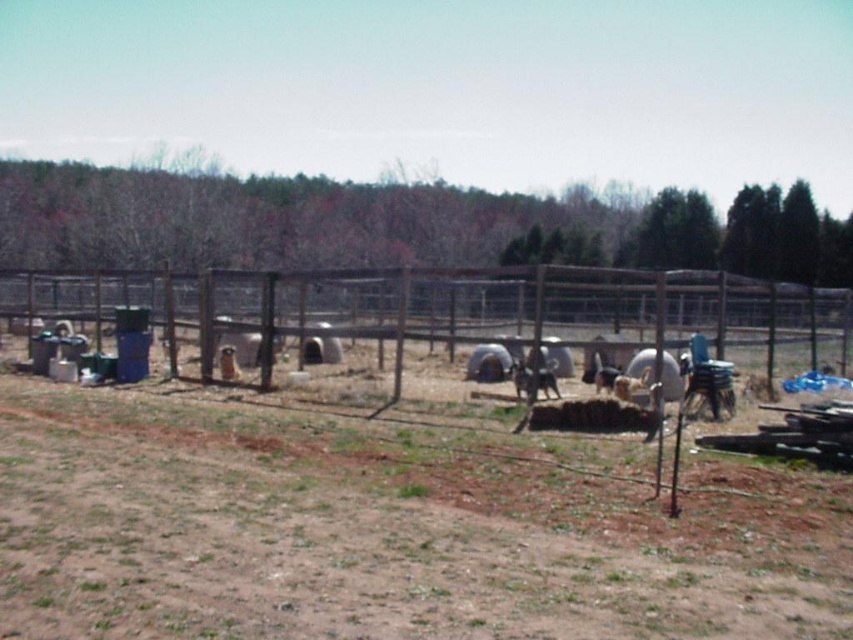
Is brown dirt field at lower center further to camera compared to brown wire fence at center?

That is False.

Does brown dirt field at lower center have a lesser width compared to brown wire fence at center?

Correct, brown dirt field at lower center's width is less than brown wire fence at center's.

Who is more forward, (289, 458) or (277, 285)?

Point (289, 458)

In order to click on brown dirt field at lower center in this screenshot , I will do `click(374, 538)`.